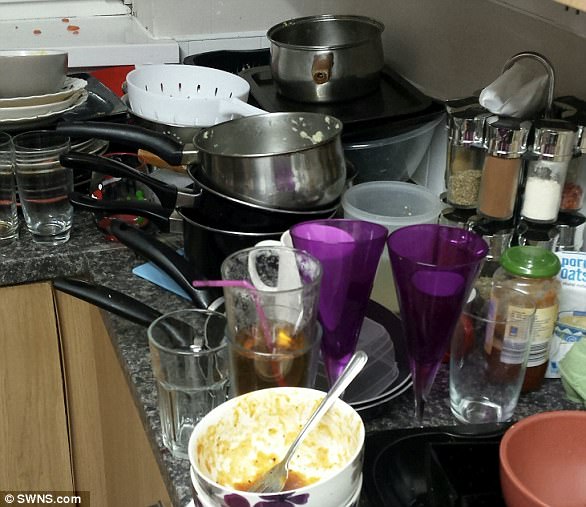
This screenshot has width=586, height=507. In order to click on dirty bowl in this screenshot , I will do `click(274, 451)`.